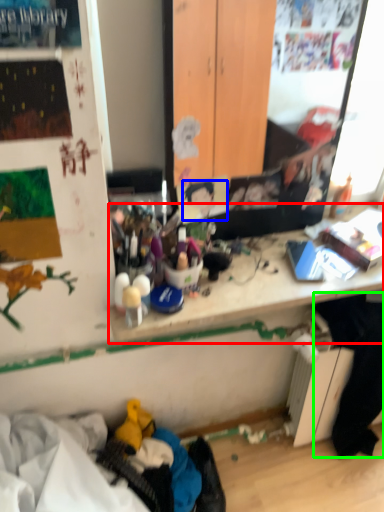
Question: Considering the real-world distances, which object is farthest from writing desk (highlighted by a red box)? person (highlighted by a blue box) or clothing (highlighted by a green box)?

Choices:
 (A) person
 (B) clothing

Answer: (B)